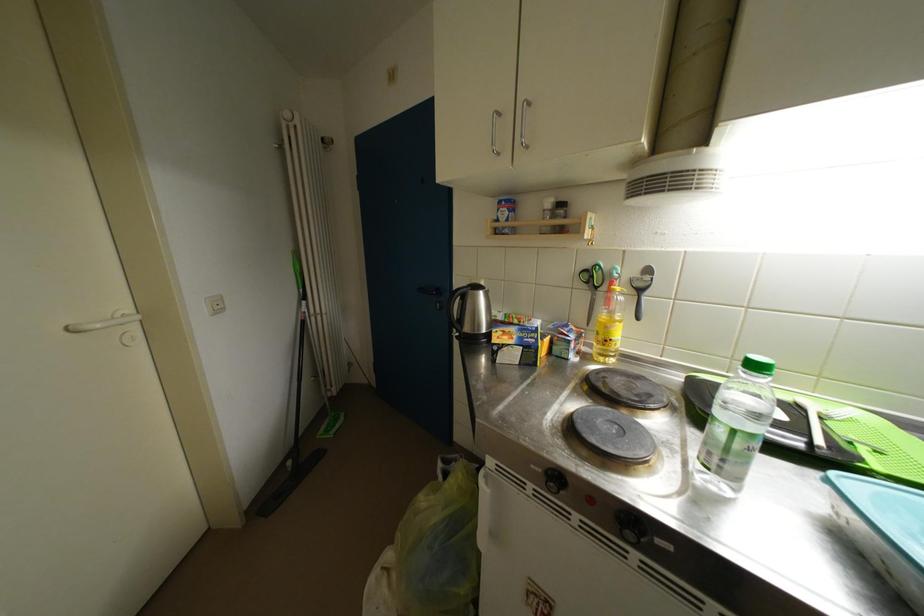
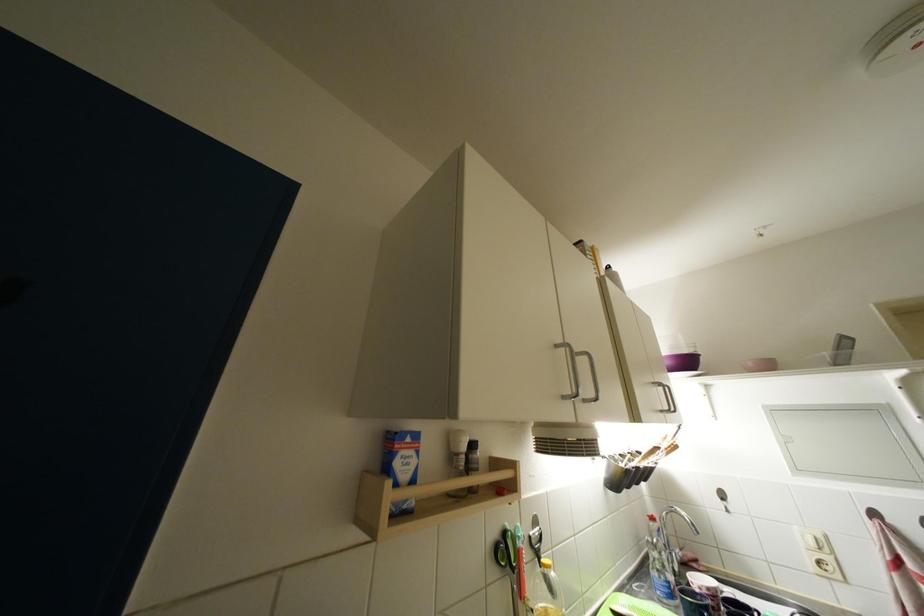
Where in the second image is the point corresponding to point 551,215 from the first image?

(464, 458)